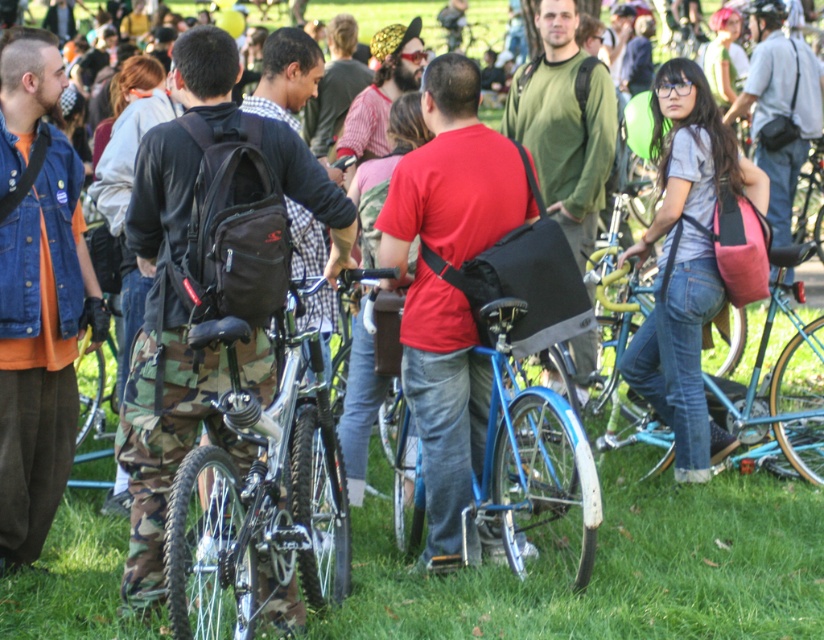
Between point (174, 598) and point (87, 416), which one is positioned behind?

The point (87, 416) is more distant.

Measure the distance from shiny black bicycle at center to shiny metallic bicycle at center.

They are 9.47 feet apart.

Who is more forward, (246, 636) or (103, 369)?

Point (246, 636) is more forward.

I want to click on shiny black bicycle at center, so click(x=260, y=492).

Is matte black backpack at center smaller than denim jeans at center?

Yes, matte black backpack at center is smaller than denim jeans at center.

Is matte black backpack at center to the right of denim jeans at center from the viewer's perspective?

No, matte black backpack at center is not to the right of denim jeans at center.

Which is in front, point (417, 220) or point (672, 70)?

Point (417, 220) is more forward.

This screenshot has width=824, height=640. What are the coordinates of `matte black backpack at center` in the screenshot? It's located at (448, 285).

What do you see at coordinates (612, 566) in the screenshot? Image resolution: width=824 pixels, height=640 pixels. I see `green grass at center` at bounding box center [612, 566].

Does green grass at center lie behind denim jeans at center?

That is False.

What do you see at coordinates (612, 566) in the screenshot? This screenshot has width=824, height=640. I see `green grass at center` at bounding box center [612, 566].

What are the coordinates of `green grass at center` in the screenshot? It's located at (612, 566).